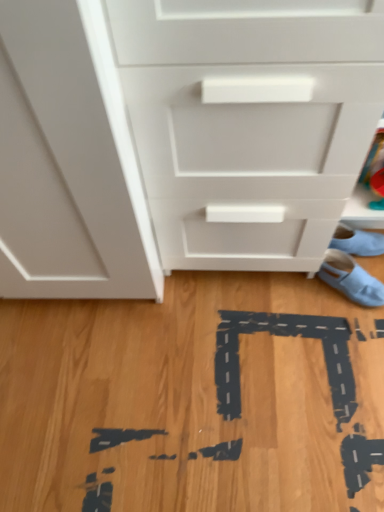
This screenshot has height=512, width=384. Describe the element at coordinates (351, 279) in the screenshot. I see `light blue fabric shoe at lower right, the 2th footwear viewed from the top` at that location.

Find the location of a particular element. white matte chest of drawers at center is located at coordinates (182, 138).

Identify the location of light blue fabric shoe at lower right, the 2th footwear viewed from the top. The height and width of the screenshot is (512, 384). (351, 279).

From the image's perspective, is white matte chest of drawers at center on light blue fabric shoe at lower right, the 2th footwear viewed from the top?

Yes, from the image's perspective, white matte chest of drawers at center is over light blue fabric shoe at lower right, the 2th footwear viewed from the top.

Which is correct: white matte chest of drawers at center is inside light blue fabric shoe at lower right, the 2th footwear viewed from the top, or outside of it?

white matte chest of drawers at center is not inside light blue fabric shoe at lower right, the 2th footwear viewed from the top, it's outside.

You are a GUI agent. You are given a task and a screenshot of the screen. Output one action in this format:
    pyautogui.click(x=<x>, y=<y>)
    Task: Click on the 1st footwear counting from the right of the white matte chest of drawers at center
    The image size is (384, 512).
    Given the screenshot: What is the action you would take?
    pyautogui.click(x=351, y=279)

Looking at the image, does white matte chest of drawers at center seem bigger or smaller compared to light blue fabric shoe at lower right, the 2th footwear viewed from the top?

In the image, white matte chest of drawers at center appears to be larger than light blue fabric shoe at lower right, the 2th footwear viewed from the top.

I want to click on footwear that is the 2nd object located behind the white matte chest of drawers at center, so click(x=357, y=241).

Is white matte chest of drawers at center beside light blue fabric shoe at lower right, which is counted as the 1th footwear, starting from the top?

No, white matte chest of drawers at center is not with light blue fabric shoe at lower right, which is counted as the 1th footwear, starting from the top.

Is white matte chest of drawers at center completely or partially outside of light blue fabric shoe at lower right, marked as the second footwear in a bottom-to-top arrangement?

white matte chest of drawers at center is positioned outside light blue fabric shoe at lower right, marked as the second footwear in a bottom-to-top arrangement.

From the image's perspective, who appears lower, light blue fabric shoe at lower right, which is counted as the 1th footwear, starting from the bottom, or light blue fabric shoe at lower right, which is counted as the 1th footwear, starting from the top?

From the image's view, light blue fabric shoe at lower right, which is counted as the 1th footwear, starting from the bottom, is below.

Is light blue fabric shoe at lower right, marked as the second footwear in a bottom-to-top arrangement, a part of light blue fabric shoe at lower right, the 2th footwear viewed from the top?

Actually, light blue fabric shoe at lower right, marked as the second footwear in a bottom-to-top arrangement, is outside light blue fabric shoe at lower right, the 2th footwear viewed from the top.

Is point (338, 262) closer or farther from the camera than point (334, 242)?

Point (338, 262).

Would you say light blue fabric shoe at lower right, marked as the second footwear in a bottom-to-top arrangement, is to the left or to the right of light blue fabric shoe at lower right, the 2th footwear viewed from the top, in the picture?

light blue fabric shoe at lower right, marked as the second footwear in a bottom-to-top arrangement, is positioned on light blue fabric shoe at lower right, the 2th footwear viewed from the top,'s right side.

Which is correct: light blue fabric shoe at lower right, which is counted as the 1th footwear, starting from the top, is inside light blue fabric shoe at lower right, the 2th footwear viewed from the top, or outside of it?

light blue fabric shoe at lower right, which is counted as the 1th footwear, starting from the top, cannot be found inside light blue fabric shoe at lower right, the 2th footwear viewed from the top.

Consider the image. Does light blue fabric shoe at lower right, marked as the second footwear in a bottom-to-top arrangement, lie in front of light blue fabric shoe at lower right, the 2th footwear viewed from the top?

No, light blue fabric shoe at lower right, marked as the second footwear in a bottom-to-top arrangement, is further to the viewer.

Which point is more forward, (349, 228) or (327, 254)?

The point (327, 254) is in front.

Can you confirm if light blue fabric shoe at lower right, which is counted as the 1th footwear, starting from the top, is positioned to the left of white matte chest of drawers at center?

No.

In the scene shown: From the image's perspective, is light blue fabric shoe at lower right, marked as the second footwear in a bottom-to-top arrangement, below white matte chest of drawers at center?

Yes, from the image's perspective, light blue fabric shoe at lower right, marked as the second footwear in a bottom-to-top arrangement, is beneath white matte chest of drawers at center.

Is point (378, 250) positioned before point (255, 53)?

No, (378, 250) is behind (255, 53).

From a real-world perspective, is light blue fabric shoe at lower right, which is counted as the 1th footwear, starting from the top, physically above white matte chest of drawers at center?

No.

Can you tell me how much light blue fabric shoe at lower right, which is counted as the 1th footwear, starting from the bottom, and white matte chest of drawers at center differ in facing direction?

light blue fabric shoe at lower right, which is counted as the 1th footwear, starting from the bottom, and white matte chest of drawers at center are facing 56.5 degrees away from each other.

Is light blue fabric shoe at lower right, the 2th footwear viewed from the top, in front of white matte chest of drawers at center?

No, light blue fabric shoe at lower right, the 2th footwear viewed from the top, is further to the viewer.

From the image's perspective, which footwear is the 2nd one below the white matte chest of drawers at center? Please provide its 2D coordinates.

[(351, 279)]

From a real-world perspective, which object stands above the other?

white matte chest of drawers at center, from a real-world perspective.

Where is `chest of drawers above the light blue fabric shoe at lower right, the 2th footwear viewed from the top (from the image's perspective)`? This screenshot has width=384, height=512. chest of drawers above the light blue fabric shoe at lower right, the 2th footwear viewed from the top (from the image's perspective) is located at coordinates (182, 138).

Identify the location of chest of drawers on the left of light blue fabric shoe at lower right, marked as the second footwear in a bottom-to-top arrangement. (182, 138).

Based on their spatial positions, is white matte chest of drawers at center or light blue fabric shoe at lower right, which is counted as the 1th footwear, starting from the top, closer to light blue fabric shoe at lower right, the 2th footwear viewed from the top?

light blue fabric shoe at lower right, which is counted as the 1th footwear, starting from the top, lies closer to light blue fabric shoe at lower right, the 2th footwear viewed from the top, than the other object.

When comparing their distances from white matte chest of drawers at center, does light blue fabric shoe at lower right, the 2th footwear viewed from the top, or light blue fabric shoe at lower right, marked as the second footwear in a bottom-to-top arrangement, seem further?

Among the two, light blue fabric shoe at lower right, marked as the second footwear in a bottom-to-top arrangement, is located further to white matte chest of drawers at center.

Looking at the image, which one is located further to light blue fabric shoe at lower right, marked as the second footwear in a bottom-to-top arrangement, white matte chest of drawers at center or light blue fabric shoe at lower right, the 2th footwear viewed from the top?

white matte chest of drawers at center.

Based on their spatial positions, is light blue fabric shoe at lower right, which is counted as the 1th footwear, starting from the bottom, or white matte chest of drawers at center closer to light blue fabric shoe at lower right, marked as the second footwear in a bottom-to-top arrangement?

light blue fabric shoe at lower right, which is counted as the 1th footwear, starting from the bottom, is closer to light blue fabric shoe at lower right, marked as the second footwear in a bottom-to-top arrangement.

Estimate the real-world distances between objects in this image. Which object is further from white matte chest of drawers at center, light blue fabric shoe at lower right, which is counted as the 1th footwear, starting from the top, or light blue fabric shoe at lower right, the 2th footwear viewed from the top?

light blue fabric shoe at lower right, which is counted as the 1th footwear, starting from the top, is positioned further to the anchor white matte chest of drawers at center.

Looking at the image, which one is located further to light blue fabric shoe at lower right, which is counted as the 1th footwear, starting from the bottom, light blue fabric shoe at lower right, which is counted as the 1th footwear, starting from the top, or white matte chest of drawers at center?

The object further to light blue fabric shoe at lower right, which is counted as the 1th footwear, starting from the bottom, is white matte chest of drawers at center.

At what (x,y) coordinates should I click in order to perform the action: click on footwear between white matte chest of drawers at center and light blue fabric shoe at lower right, marked as the second footwear in a bottom-to-top arrangement, from front to back. Please return your answer as a coordinate pair (x, y). Image resolution: width=384 pixels, height=512 pixels. Looking at the image, I should click on (351, 279).